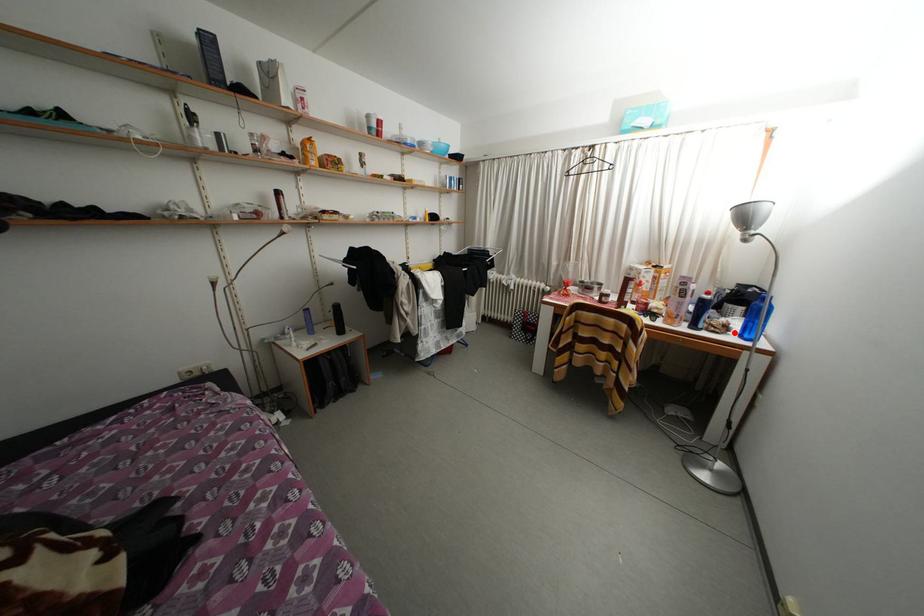
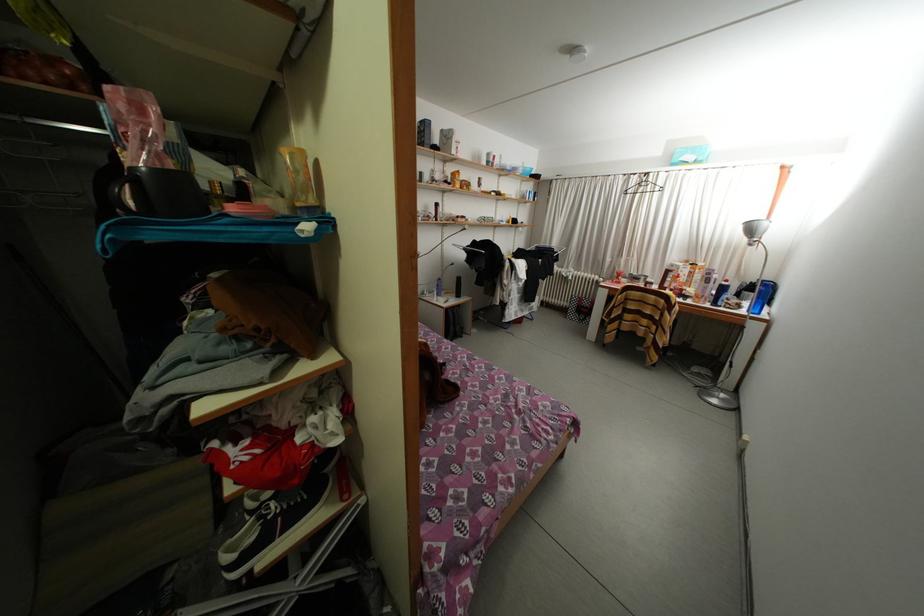
In the second image, find the point that corresponds to the highlighted location in the first image.

(747, 310)